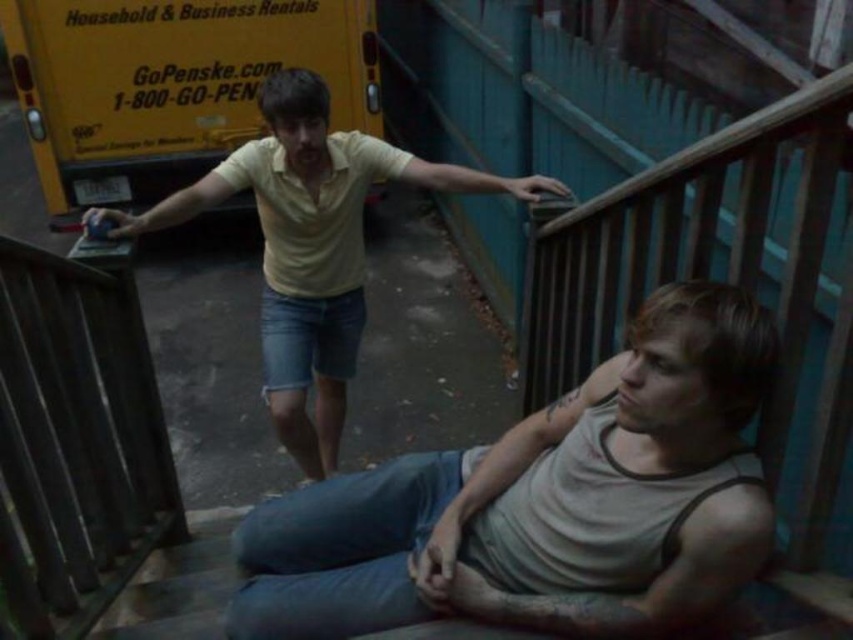
Question: Among these objects, which one is farthest from the camera?

Choices:
 (A) gray cotton tank top at lower right
 (B) yellow cotton shirt at upper center
 (C) yellow matte truck at upper left

Answer: (C)

Question: Can you confirm if gray cotton tank top at lower right is smaller than yellow cotton shirt at upper center?

Choices:
 (A) no
 (B) yes

Answer: (B)

Question: Among these points, which one is farthest from the camera?

Choices:
 (A) (326, 392)
 (B) (289, 548)
 (C) (91, 356)

Answer: (A)

Question: Does gray cotton tank top at lower right appear under yellow matte truck at upper left?

Choices:
 (A) yes
 (B) no

Answer: (A)

Question: Among these objects, which one is nearest to the camera?

Choices:
 (A) gray cotton tank top at lower right
 (B) wooden balustrade at lower left
 (C) yellow cotton shirt at upper center

Answer: (A)

Question: Does yellow matte truck at upper left appear on the left side of yellow cotton shirt at upper center?

Choices:
 (A) no
 (B) yes

Answer: (B)